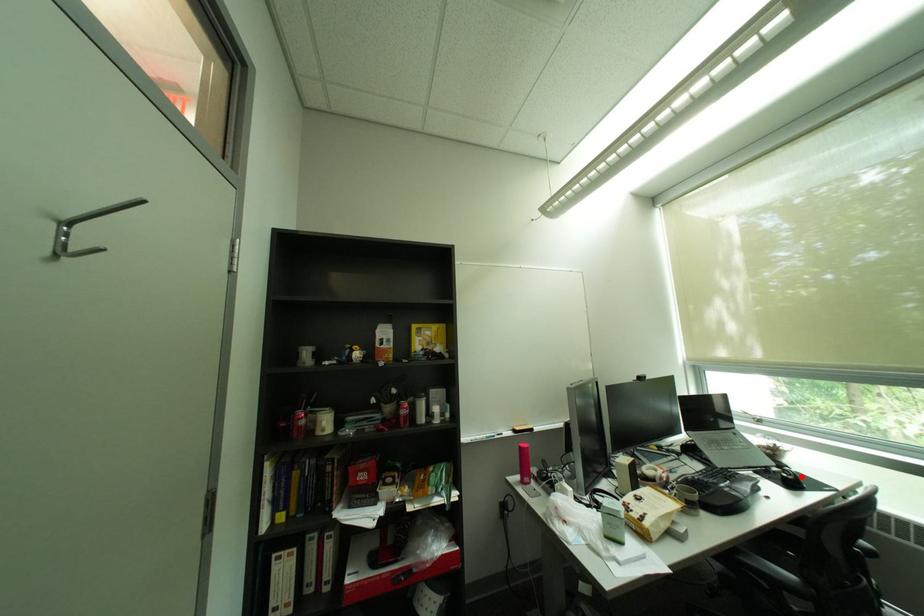
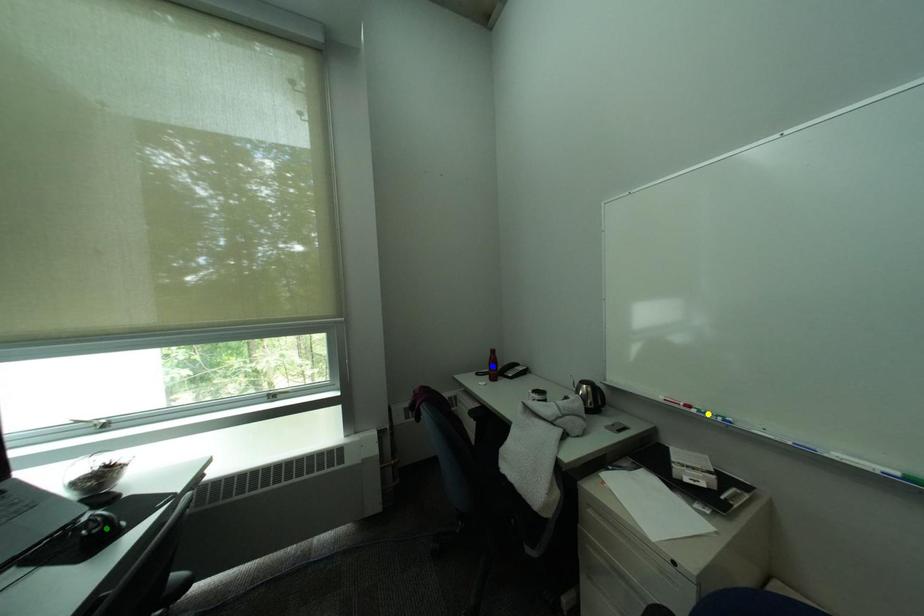
Question: I am providing you with two images of the same scene from different viewpoints. A red point is marked on the first image. You are given multiple points on the second image. In image 2, which mark is for the same physical point as the one in image 1?

Choices:
 (A) yellow point
 (B) green point
 (C) blue point

Answer: (B)